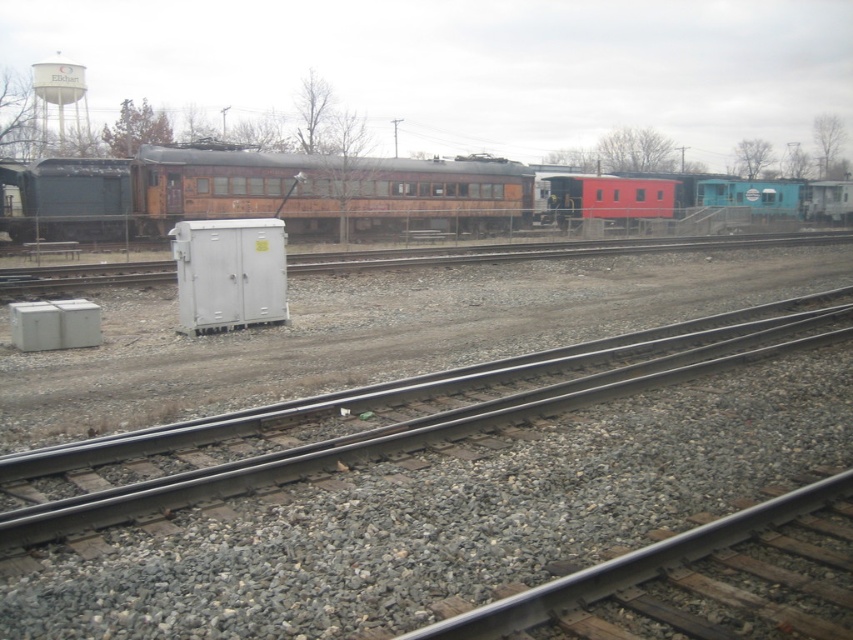
You are a worker in the railway yard and need to place a heavy equipment box on the ground. You have two options for placement near the gray metallic train track at center and the gray gravel at lower left. Which location would provide a more stable surface for the box?

The gray metallic train track at center is above the gray gravel at lower left, so placing the box on the train track would provide a more stable surface compared to the gravel.

You are a worker in the railway yard and need to walk from the gray gravel at lower left to the gray metallic train track at center. Which direction should you move to get closer to the train track?

You should move forward because the gray metallic train track at center is closer to you than the gray gravel at lower left, so moving towards it would bring you closer.

Consider the image. You are a maintenance worker checking the railway yard. You notice the gray metallic train track at center and the gray gravel at lower left. Which object is taller?

The gray metallic train track at center is taller than the gray gravel at lower left.